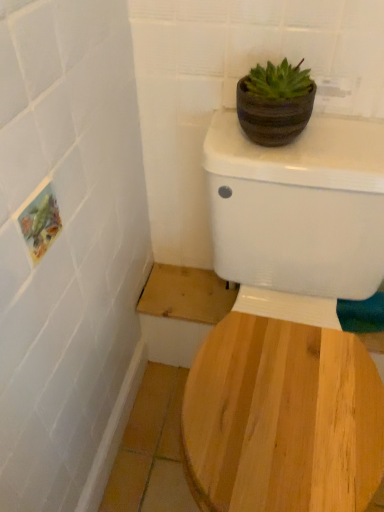
Question: Is point (205, 408) closer or farther from the camera than point (276, 135)?

Choices:
 (A) closer
 (B) farther

Answer: (A)

Question: Based on their positions, is white glossy toilet at upper center located to the left or right of brown striped pot at upper right?

Choices:
 (A) right
 (B) left

Answer: (A)

Question: From the image's perspective, relative to brown striped pot at upper right, is white glossy toilet at upper center above or below?

Choices:
 (A) below
 (B) above

Answer: (A)

Question: Is brown striped pot at upper right inside the boundaries of white glossy toilet at upper center, or outside?

Choices:
 (A) inside
 (B) outside

Answer: (B)

Question: From the image's perspective, is brown striped pot at upper right above or below white glossy toilet at upper center?

Choices:
 (A) below
 (B) above

Answer: (B)

Question: Considering the positions of brown striped pot at upper right and white glossy toilet at upper center in the image, is brown striped pot at upper right wider or thinner than white glossy toilet at upper center?

Choices:
 (A) wide
 (B) thin

Answer: (B)

Question: Considering the positions of brown striped pot at upper right and white glossy toilet at upper center in the image, is brown striped pot at upper right bigger or smaller than white glossy toilet at upper center?

Choices:
 (A) small
 (B) big

Answer: (A)